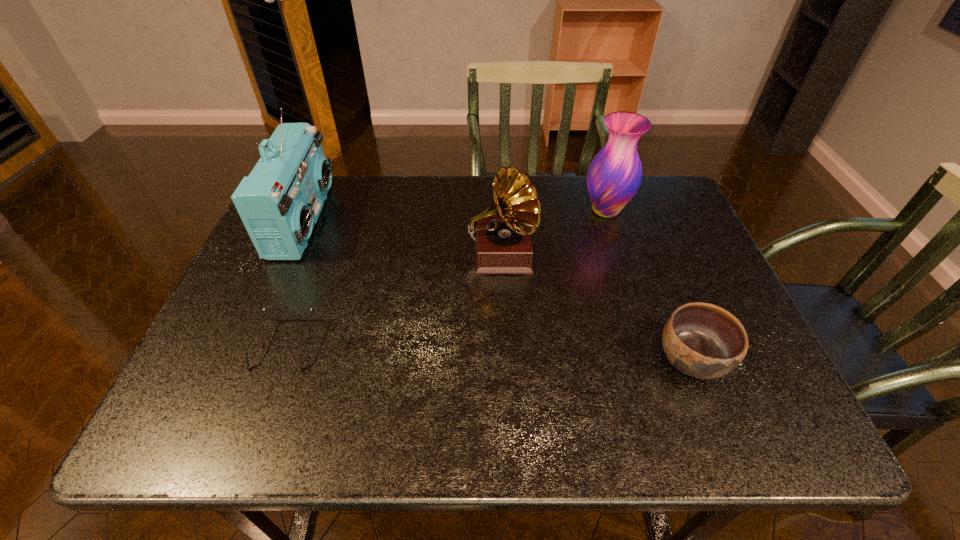
I want to click on radio receiver situated at the far edge, so click(280, 201).

You are a GUI agent. You are given a task and a screenshot of the screen. Output one action in this format:
    pyautogui.click(x=<x>, y=<y>)
    Task: Click on the vase located in the far edge section of the desktop
    
    Given the screenshot: What is the action you would take?
    pyautogui.click(x=614, y=175)

At what (x,y) coordinates should I click in order to perform the action: click on radio receiver located in the left edge section of the desktop. Please return your answer as a coordinate pair (x, y). This screenshot has height=540, width=960. Looking at the image, I should click on point(280,201).

Locate an element on the screen. The image size is (960, 540). spectacles present at the left edge is located at coordinates (264, 308).

Image resolution: width=960 pixels, height=540 pixels. What are the coordinates of `vase at the right edge` in the screenshot? It's located at (614, 175).

Locate an element on the screen. The height and width of the screenshot is (540, 960). bowl located at the right edge is located at coordinates (702, 340).

The image size is (960, 540). I want to click on object present at the far left corner, so click(x=280, y=201).

I want to click on object present at the far right corner, so click(x=614, y=175).

This screenshot has width=960, height=540. What are the coordinates of `vacant region at the far edge of the desktop` in the screenshot? It's located at (427, 197).

Find the location of `free space at the near edge`. free space at the near edge is located at coordinates (454, 429).